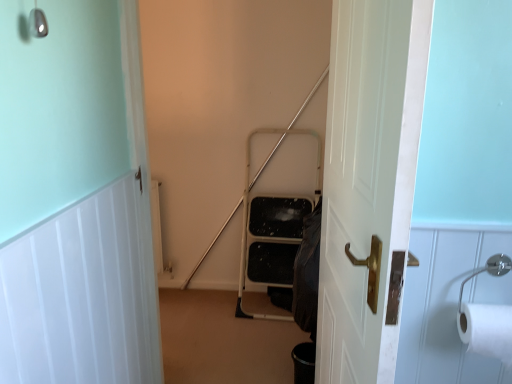
Question: Is the depth of white paper at right greater than that of white wood door at upper left, which is the first door from left to right?

Choices:
 (A) no
 (B) yes

Answer: (B)

Question: From the image's perspective, is white paper at right on white wood door at upper left, the 2th door when ordered from right to left?

Choices:
 (A) yes
 (B) no

Answer: (A)

Question: Does white paper at right have a lesser width compared to white wood door at upper left, which is the first door from left to right?

Choices:
 (A) no
 (B) yes

Answer: (A)

Question: Does white paper at right turn towards white wood door at upper left, the 2th door when ordered from right to left?

Choices:
 (A) yes
 (B) no

Answer: (B)

Question: Can you confirm if white paper at right is wider than white wood door at upper left, which is the first door from left to right?

Choices:
 (A) no
 (B) yes

Answer: (B)

Question: Is white paper at right positioned in front of white wood door at upper left, the 2th door when ordered from right to left?

Choices:
 (A) no
 (B) yes

Answer: (A)

Question: Is white wood door at upper left, the 2th door when ordered from right to left, not close to white wooden door at center, which ranks as the second door in left-to-right order?

Choices:
 (A) yes
 (B) no

Answer: (B)

Question: Does white wood door at upper left, the 2th door when ordered from right to left, have a larger size compared to white wooden door at center, marked as the first door in a right-to-left arrangement?

Choices:
 (A) yes
 (B) no

Answer: (B)

Question: Could you tell me if white wood door at upper left, which is the first door from left to right, is turned towards white wooden door at center, marked as the first door in a right-to-left arrangement?

Choices:
 (A) no
 (B) yes

Answer: (B)

Question: Is white wood door at upper left, the 2th door when ordered from right to left, not within white wooden door at center, which ranks as the second door in left-to-right order?

Choices:
 (A) yes
 (B) no

Answer: (A)

Question: Considering the relative sizes of white wood door at upper left, the 2th door when ordered from right to left, and white wooden door at center, which ranks as the second door in left-to-right order, in the image provided, is white wood door at upper left, the 2th door when ordered from right to left, taller than white wooden door at center, which ranks as the second door in left-to-right order,?

Choices:
 (A) yes
 (B) no

Answer: (B)

Question: From the image's perspective, is white wood door at upper left, the 2th door when ordered from right to left, above white wooden door at center, marked as the first door in a right-to-left arrangement?

Choices:
 (A) no
 (B) yes

Answer: (A)

Question: Is white wooden door at center, marked as the first door in a right-to-left arrangement, in contact with white paper at right?

Choices:
 (A) yes
 (B) no

Answer: (B)